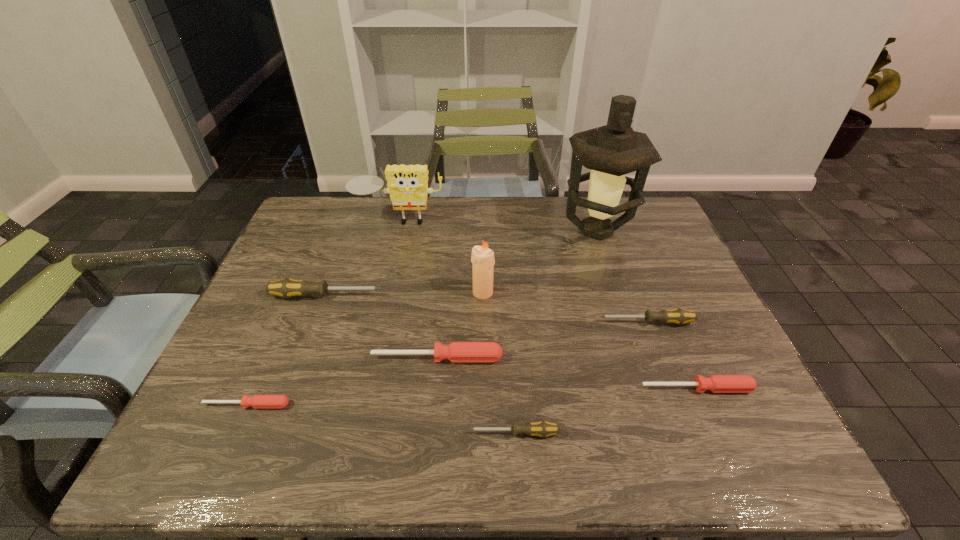
Where is `the rightmost red screwdriver`? The height and width of the screenshot is (540, 960). the rightmost red screwdriver is located at coordinates point(715,383).

The width and height of the screenshot is (960, 540). I want to click on the nearest screwdriver, so click(x=543, y=429).

The height and width of the screenshot is (540, 960). What are the coordinates of `the nearest gray screwdriver` in the screenshot? It's located at (543, 429).

The height and width of the screenshot is (540, 960). Find the location of `the eighth farthest object`. the eighth farthest object is located at coordinates (258, 401).

I want to click on the smallest red screwdriver, so click(x=258, y=401).

The width and height of the screenshot is (960, 540). Identify the location of free space located on the front of the tallest object. (622, 306).

This screenshot has width=960, height=540. I want to click on vacant area situated on the front-facing side of the yellow sponge, so [x=382, y=295].

In order to click on vacant space situated 0.240m on the right of the candle in this screenshot , I will do `click(584, 293)`.

In order to click on free region located 0.200m at the tip of the tallest screwdriver in this screenshot , I will do `click(458, 295)`.

At what (x,y) coordinates should I click in order to perform the action: click on free space located at the tip of the fifth nearest object. Please return your answer as a coordinate pair (x, y). This screenshot has height=540, width=960. Looking at the image, I should click on (445, 322).